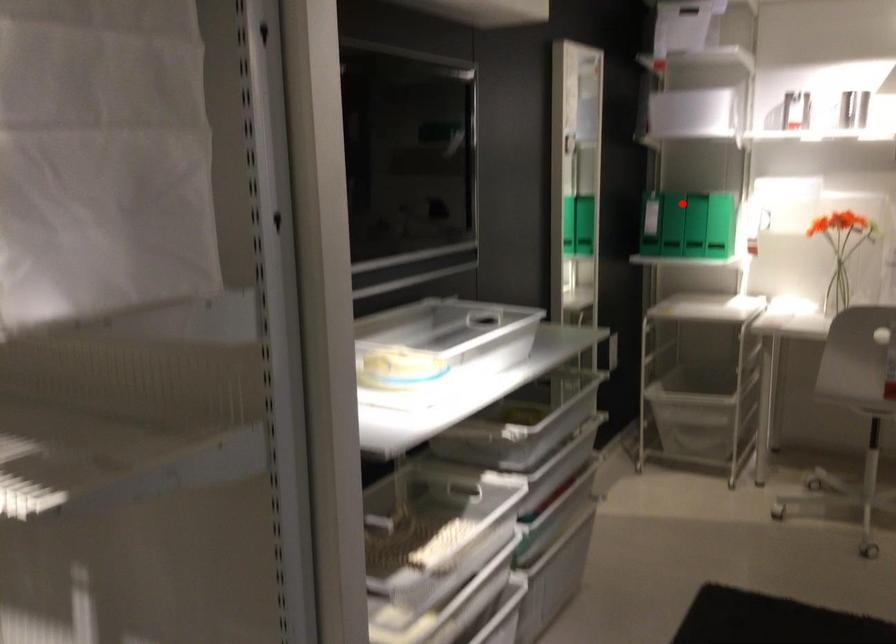
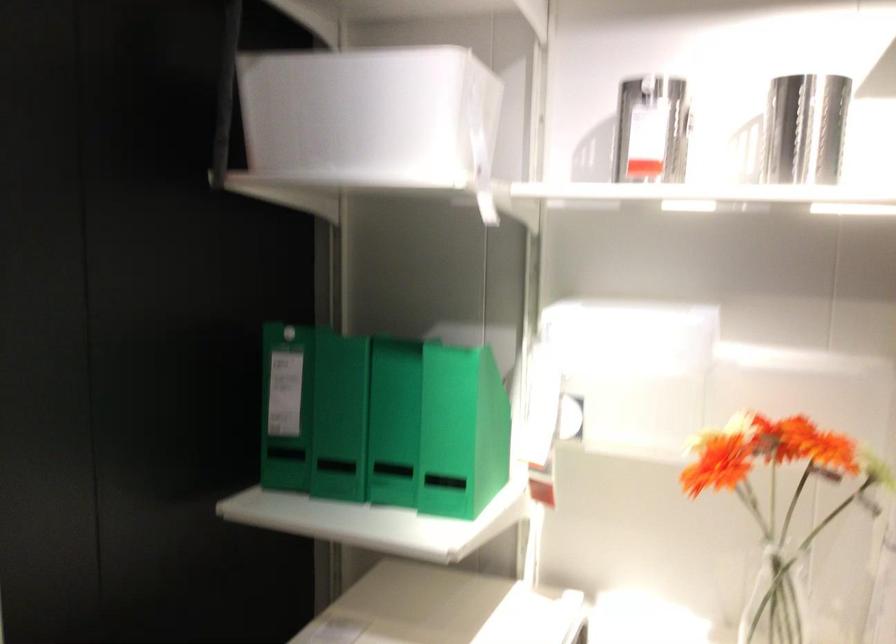
Question: I am providing you with two images of the same scene from different viewpoints. Image1 has a red point marked. In image2, the corresponding 3D location appears at what relative position? Reply with the corresponding letter.

Choices:
 (A) Closer
 (B) Farther

Answer: (A)